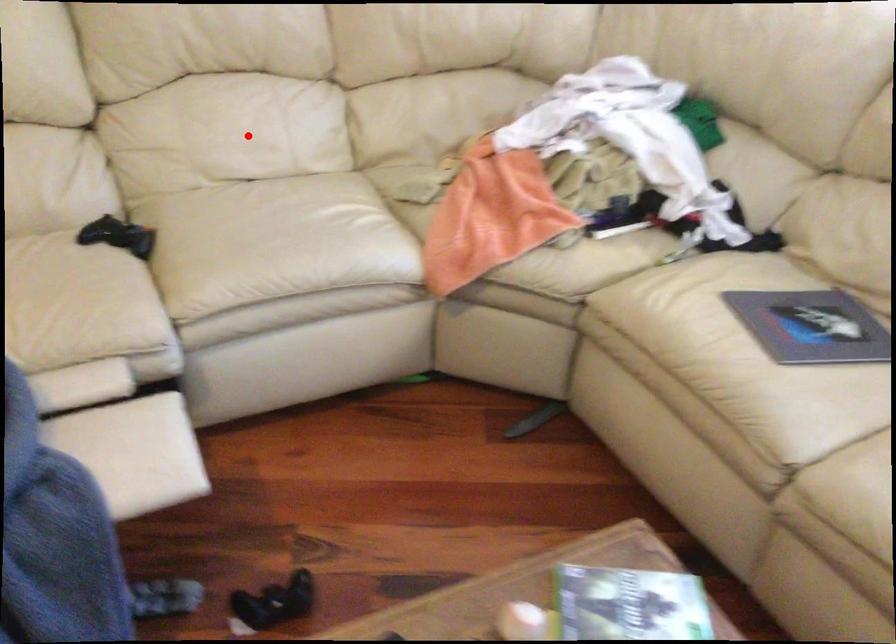
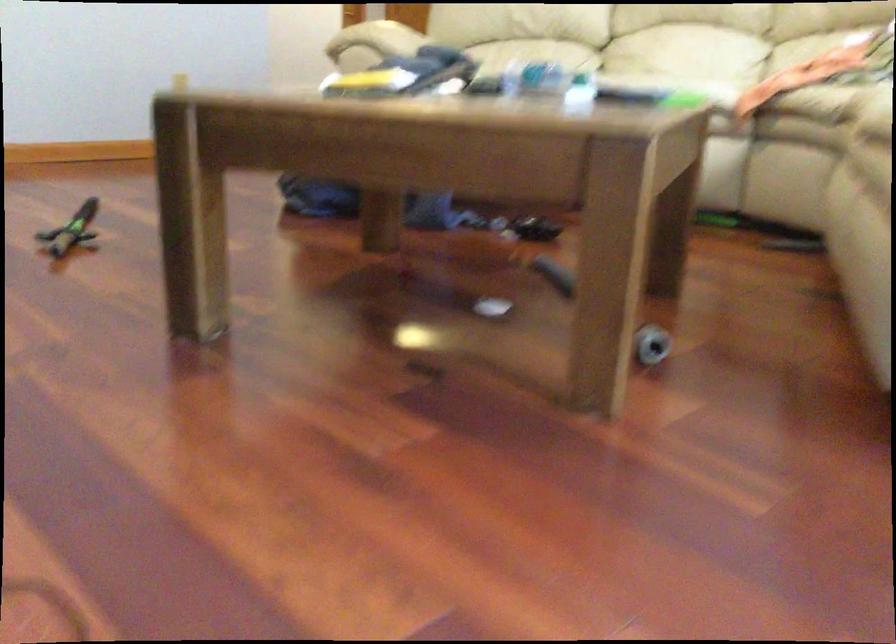
Find the pixel in the second image that matches the highlighted location in the first image.

(686, 59)